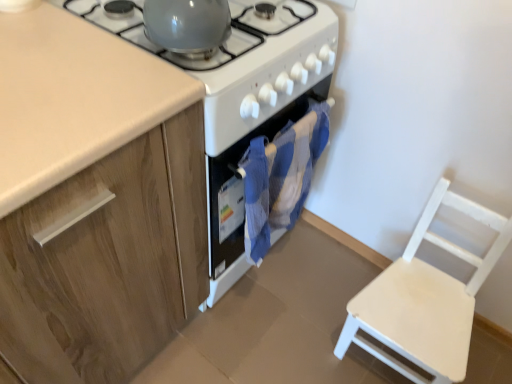
Question: Does wooden cabinet at left turn towards blue fabric oven at center?

Choices:
 (A) yes
 (B) no

Answer: (B)

Question: From a real-world perspective, is wooden cabinet at left under blue fabric oven at center?

Choices:
 (A) no
 (B) yes

Answer: (A)

Question: Is wooden cabinet at left thinner than blue fabric oven at center?

Choices:
 (A) yes
 (B) no

Answer: (B)

Question: Does wooden cabinet at left have a smaller size compared to blue fabric oven at center?

Choices:
 (A) no
 (B) yes

Answer: (A)

Question: From the image's perspective, is wooden cabinet at left above blue fabric oven at center?

Choices:
 (A) yes
 (B) no

Answer: (B)

Question: Would you say wooden cabinet at left is to the left or to the right of white wooden chair at lower right in the picture?

Choices:
 (A) left
 (B) right

Answer: (A)

Question: Looking at their shapes, would you say wooden cabinet at left is wider or thinner than white wooden chair at lower right?

Choices:
 (A) thin
 (B) wide

Answer: (B)

Question: From their relative heights in the image, would you say wooden cabinet at left is taller or shorter than white wooden chair at lower right?

Choices:
 (A) tall
 (B) short

Answer: (A)

Question: In terms of size, does wooden cabinet at left appear bigger or smaller than white wooden chair at lower right?

Choices:
 (A) big
 (B) small

Answer: (A)

Question: Considering the positions of blue fabric oven at center and glossy ceramic kettle at upper center, acting as the first gas stove starting from the right, in the image, is blue fabric oven at center taller or shorter than glossy ceramic kettle at upper center, acting as the first gas stove starting from the right,?

Choices:
 (A) tall
 (B) short

Answer: (A)

Question: Is blue fabric oven at center wider or thinner than glossy ceramic kettle at upper center, the 2th gas stove viewed from the left?

Choices:
 (A) thin
 (B) wide

Answer: (A)

Question: Which is correct: blue fabric oven at center is inside glossy ceramic kettle at upper center, the 2th gas stove viewed from the left, or outside of it?

Choices:
 (A) inside
 (B) outside

Answer: (B)

Question: Does point (273, 125) appear closer or farther from the camera than point (93, 21)?

Choices:
 (A) closer
 (B) farther

Answer: (B)

Question: In the image, is wooden cabinet at left on the left side or the right side of white glossy stove at center?

Choices:
 (A) left
 (B) right

Answer: (A)

Question: Is wooden cabinet at left wider or thinner than white glossy stove at center?

Choices:
 (A) wide
 (B) thin

Answer: (A)